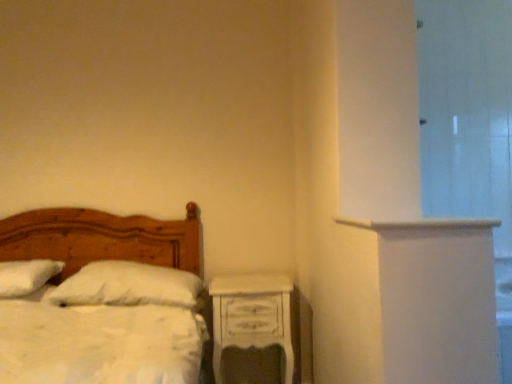
Question: Would you say white fluffy pillow at left, marked as the 1th pillow in a left-to-right arrangement, contains white painted wood ledge at upper right?

Choices:
 (A) no
 (B) yes

Answer: (A)

Question: Is white fluffy pillow at left, marked as the 1th pillow in a left-to-right arrangement, next to white painted wood ledge at upper right and touching it?

Choices:
 (A) yes
 (B) no

Answer: (B)

Question: From a real-world perspective, is white fluffy pillow at left, which ranks as the 2th pillow in right-to-left order, on white painted wood ledge at upper right?

Choices:
 (A) yes
 (B) no

Answer: (B)

Question: Does white fluffy pillow at left, marked as the 1th pillow in a left-to-right arrangement, appear on the right side of white painted wood ledge at upper right?

Choices:
 (A) no
 (B) yes

Answer: (A)

Question: Is white fluffy pillow at left, marked as the 1th pillow in a left-to-right arrangement, positioned in front of white painted wood ledge at upper right?

Choices:
 (A) no
 (B) yes

Answer: (A)

Question: In terms of size, does white painted wood nightstand at lower right appear bigger or smaller than transparent glass door at right?

Choices:
 (A) small
 (B) big

Answer: (B)

Question: Looking at their shapes, would you say white painted wood nightstand at lower right is wider or thinner than transparent glass door at right?

Choices:
 (A) wide
 (B) thin

Answer: (B)

Question: From a real-world perspective, is white painted wood nightstand at lower right above or below transparent glass door at right?

Choices:
 (A) below
 (B) above

Answer: (A)

Question: Visually, is white painted wood nightstand at lower right positioned to the left or to the right of transparent glass door at right?

Choices:
 (A) left
 (B) right

Answer: (A)

Question: Relative to white painted wood ledge at upper right, is white fluffy pillow at left, marked as the 1th pillow in a left-to-right arrangement, in front or behind?

Choices:
 (A) behind
 (B) front

Answer: (A)

Question: Considering the positions of white fluffy pillow at left, marked as the 1th pillow in a left-to-right arrangement, and white painted wood ledge at upper right in the image, is white fluffy pillow at left, marked as the 1th pillow in a left-to-right arrangement, wider or thinner than white painted wood ledge at upper right?

Choices:
 (A) wide
 (B) thin

Answer: (B)

Question: From a real-world perspective, is white fluffy pillow at left, marked as the 1th pillow in a left-to-right arrangement, above or below white painted wood ledge at upper right?

Choices:
 (A) above
 (B) below

Answer: (B)

Question: Do you think white fluffy pillow at left, which ranks as the 2th pillow in right-to-left order, is within white painted wood ledge at upper right, or outside of it?

Choices:
 (A) outside
 (B) inside

Answer: (A)

Question: In terms of size, does white soft pillow at center, which ranks as the 2th pillow in left-to-right order, appear bigger or smaller than wooden bed at left?

Choices:
 (A) big
 (B) small

Answer: (B)

Question: Relative to wooden bed at left, is white soft pillow at center, which ranks as the 2th pillow in left-to-right order, in front or behind?

Choices:
 (A) behind
 (B) front

Answer: (A)